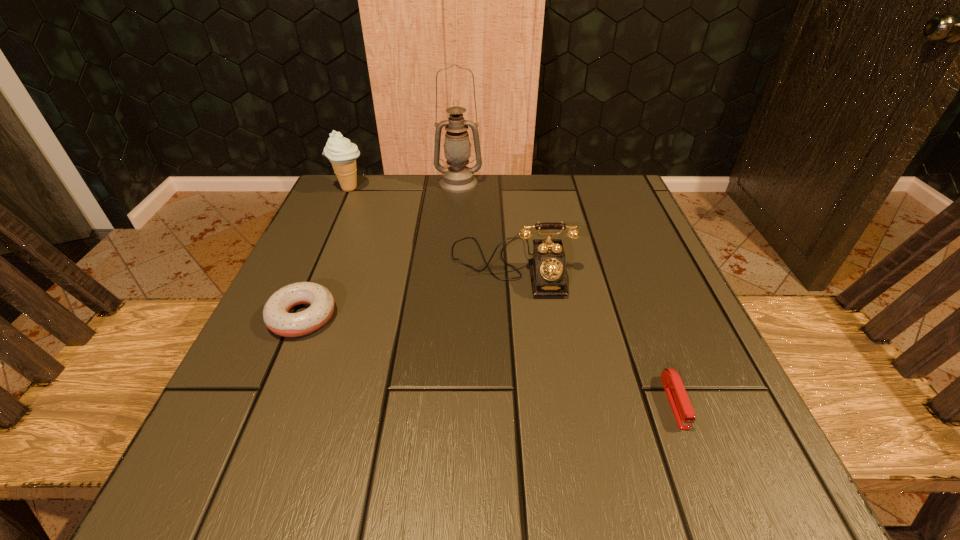
The height and width of the screenshot is (540, 960). In order to click on free region located 0.060m on the front-facing side of the rightmost object in this screenshot , I will do `click(702, 474)`.

Where is `oil lamp that is positioned at the far edge`? The image size is (960, 540). oil lamp that is positioned at the far edge is located at coordinates (458, 178).

I want to click on icecream at the far edge, so click(342, 154).

Locate an element on the screen. icecream present at the left edge is located at coordinates (342, 154).

Locate an element on the screen. doughnut present at the left edge is located at coordinates [x=275, y=313].

Identify the location of object that is at the right edge. The height and width of the screenshot is (540, 960). click(x=680, y=404).

At what (x,y) coordinates should I click in order to perform the action: click on object located in the far left corner section of the desktop. Please return your answer as a coordinate pair (x, y). Looking at the image, I should click on (342, 154).

In the image, there is a desktop. Identify the location of vacant space at the far edge. The image size is (960, 540). (563, 201).

I want to click on free region at the near edge of the desktop, so click(x=617, y=450).

The image size is (960, 540). I want to click on vacant space at the left edge, so click(x=275, y=401).